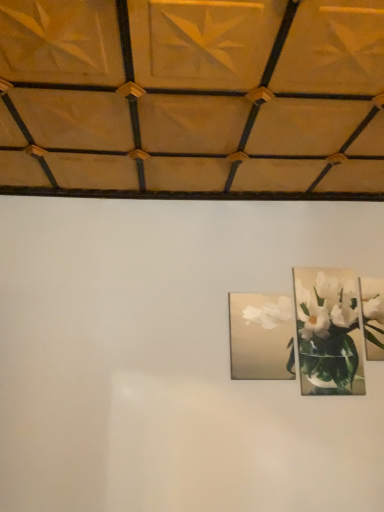
Question: From the image's perspective, is matte silver picture frame at center, which appears as the third picture frame when viewed from the right, beneath metallic silver picture frame at upper right, the third picture frame when ordered from left to right?

Choices:
 (A) yes
 (B) no

Answer: (A)

Question: Considering the relative sizes of matte silver picture frame at center, which appears as the third picture frame when viewed from the right, and metallic silver picture frame at upper right, the third picture frame when ordered from left to right, in the image provided, is matte silver picture frame at center, which appears as the third picture frame when viewed from the right, wider than metallic silver picture frame at upper right, the third picture frame when ordered from left to right,?

Choices:
 (A) no
 (B) yes

Answer: (B)

Question: Does matte silver picture frame at center, marked as the first picture frame in a left-to-right arrangement, have a greater height compared to metallic silver picture frame at upper right, the first picture frame when ordered from right to left?

Choices:
 (A) no
 (B) yes

Answer: (A)

Question: Does matte silver picture frame at center, which appears as the third picture frame when viewed from the right, have a lesser width compared to metallic silver picture frame at upper right, the third picture frame when ordered from left to right?

Choices:
 (A) no
 (B) yes

Answer: (A)

Question: Is matte silver picture frame at center, which appears as the third picture frame when viewed from the right, shorter than metallic silver picture frame at upper right, the third picture frame when ordered from left to right?

Choices:
 (A) no
 (B) yes

Answer: (B)

Question: Does matte silver picture frame at center, which appears as the third picture frame when viewed from the right, contain metallic silver picture frame at upper right, the third picture frame when ordered from left to right?

Choices:
 (A) no
 (B) yes

Answer: (A)

Question: Is matte silver picture frame at center, marked as the first picture frame in a left-to-right arrangement, turned away from metallic silver frame at upper right, marked as the 2th picture frame in a right-to-left arrangement?

Choices:
 (A) no
 (B) yes

Answer: (A)

Question: From a real-world perspective, does matte silver picture frame at center, which appears as the third picture frame when viewed from the right, sit lower than metallic silver frame at upper right, which is the 2th picture frame in left-to-right order?

Choices:
 (A) no
 (B) yes

Answer: (B)

Question: Does matte silver picture frame at center, which appears as the third picture frame when viewed from the right, turn towards metallic silver frame at upper right, marked as the 2th picture frame in a right-to-left arrangement?

Choices:
 (A) no
 (B) yes

Answer: (A)

Question: Are matte silver picture frame at center, which appears as the third picture frame when viewed from the right, and metallic silver frame at upper right, marked as the 2th picture frame in a right-to-left arrangement, beside each other?

Choices:
 (A) no
 (B) yes

Answer: (A)

Question: Considering the relative sizes of matte silver picture frame at center, which appears as the third picture frame when viewed from the right, and metallic silver frame at upper right, which is the 2th picture frame in left-to-right order, in the image provided, is matte silver picture frame at center, which appears as the third picture frame when viewed from the right, taller than metallic silver frame at upper right, which is the 2th picture frame in left-to-right order,?

Choices:
 (A) no
 (B) yes

Answer: (A)

Question: Considering the relative positions of matte silver picture frame at center, marked as the first picture frame in a left-to-right arrangement, and metallic silver frame at upper right, marked as the 2th picture frame in a right-to-left arrangement, in the image provided, is matte silver picture frame at center, marked as the first picture frame in a left-to-right arrangement, behind metallic silver frame at upper right, marked as the 2th picture frame in a right-to-left arrangement,?

Choices:
 (A) no
 (B) yes

Answer: (A)

Question: From the image's perspective, is metallic silver frame at upper right, marked as the 2th picture frame in a right-to-left arrangement, on top of metallic silver picture frame at upper right, the first picture frame when ordered from right to left?

Choices:
 (A) no
 (B) yes

Answer: (A)